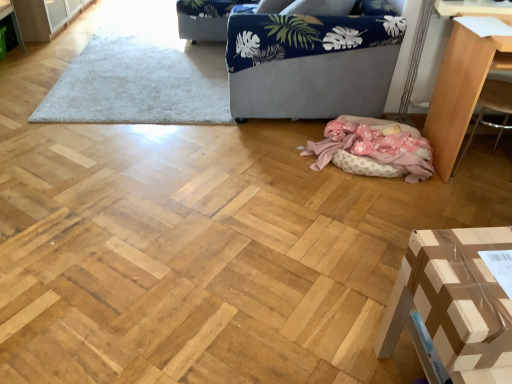
Question: Considering the relative sizes of pink polka dot fabric at lower center and white shaggy rug at upper center in the image provided, is pink polka dot fabric at lower center smaller than white shaggy rug at upper center?

Choices:
 (A) no
 (B) yes

Answer: (B)

Question: Does pink polka dot fabric at lower center appear on the right side of white shaggy rug at upper center?

Choices:
 (A) no
 (B) yes

Answer: (B)

Question: From a real-world perspective, does pink polka dot fabric at lower center sit lower than white shaggy rug at upper center?

Choices:
 (A) no
 (B) yes

Answer: (A)

Question: Is white shaggy rug at upper center completely or partially inside pink polka dot fabric at lower center?

Choices:
 (A) no
 (B) yes

Answer: (A)

Question: From a real-world perspective, is pink polka dot fabric at lower center located higher than white shaggy rug at upper center?

Choices:
 (A) yes
 (B) no

Answer: (A)

Question: Which is correct: blue fabric armchair at upper center, which is the 2th armchair from front to back, is inside pink polka dot fabric at lower center, or outside of it?

Choices:
 (A) outside
 (B) inside

Answer: (A)

Question: Based on their positions, is blue fabric armchair at upper center, the first armchair viewed from the top, located to the left or right of pink polka dot fabric at lower center?

Choices:
 (A) left
 (B) right

Answer: (A)

Question: From a real-world perspective, is blue fabric armchair at upper center, the 1th armchair when ordered from left to right, physically located above or below pink polka dot fabric at lower center?

Choices:
 (A) below
 (B) above

Answer: (B)

Question: Does point (202, 3) appear closer or farther from the camera than point (400, 144)?

Choices:
 (A) closer
 (B) farther

Answer: (B)

Question: From the image's perspective, is light brown wood table at right, which appears as the first furniture when viewed from the right, above or below white shaggy rug at upper center?

Choices:
 (A) above
 (B) below

Answer: (B)

Question: Is point (466, 81) closer or farther from the camera than point (152, 67)?

Choices:
 (A) closer
 (B) farther

Answer: (A)

Question: From their relative heights in the image, would you say light brown wood table at right, positioned as the second furniture in bottom-to-top order, is taller or shorter than white shaggy rug at upper center?

Choices:
 (A) short
 (B) tall

Answer: (B)

Question: Based on their positions, is light brown wood table at right, the second furniture viewed from the left, located to the left or right of white shaggy rug at upper center?

Choices:
 (A) left
 (B) right

Answer: (B)

Question: Considering the positions of blue fabric armchair at upper center, positioned as the first armchair in back-to-front order, and light brown wood table at right, the first furniture viewed from the top, in the image, is blue fabric armchair at upper center, positioned as the first armchair in back-to-front order, taller or shorter than light brown wood table at right, the first furniture viewed from the top,?

Choices:
 (A) short
 (B) tall

Answer: (A)

Question: Considering the relative positions of blue fabric armchair at upper center, which is the 2th armchair from front to back, and light brown wood table at right, the second furniture viewed from the left, in the image provided, is blue fabric armchair at upper center, which is the 2th armchair from front to back, to the left or to the right of light brown wood table at right, the second furniture viewed from the left,?

Choices:
 (A) right
 (B) left

Answer: (B)